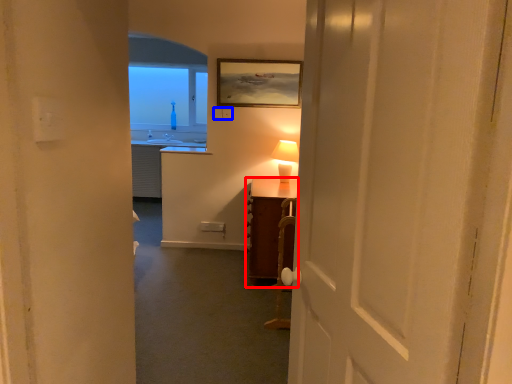
Question: Which point is closer to the camera, table (highlighted by a red box) or electric outlet (highlighted by a blue box)?

Choices:
 (A) table
 (B) electric outlet

Answer: (A)